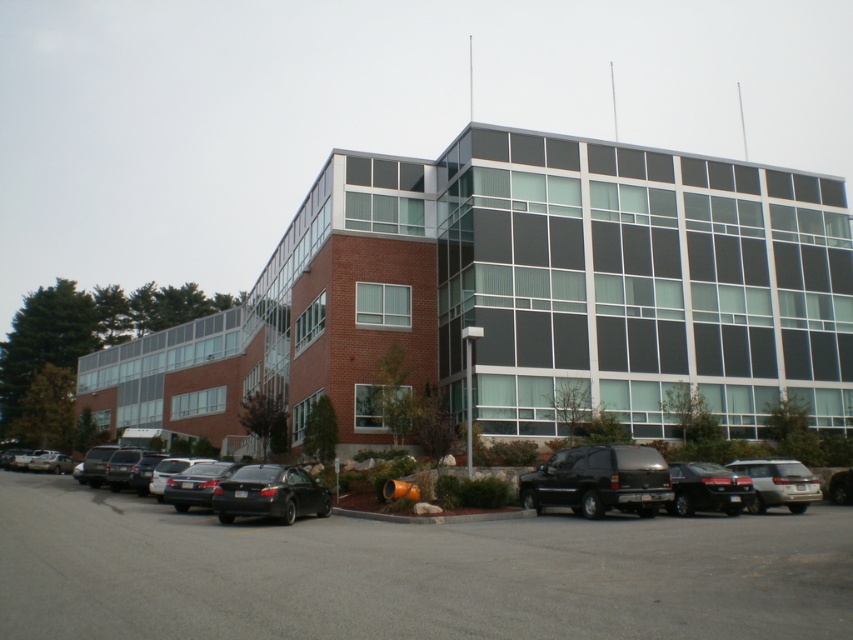
You are a delivery person needing to park your delivery van that is 14 feet long. You see the gray asphalt parking lot at lower center and the black matte suv at center. Can your van fit in the parking space between them?

The distance between the gray asphalt parking lot at lower center and the black matte suv at center is 15.55 feet. Since your van is 14 feet long, it can fit in the parking space between them as there is enough space.

You are standing at the entrance of the building and want to locate the satin black suv at center. According to the coordinates provided, in which direction should you look to find it?

The satin black suv at center is located at coordinates point (706, 488), so you should look towards the center of the parking lot to find it.

You are a delivery person trying to park your van in the gray asphalt parking lot at lower center. There is a black matte suv at center blocking the entrance. Can you drive around the suv to access the parking lot?

The gray asphalt parking lot at lower center is in front of the black matte suv at center, meaning the suv is between you and the parking lot entrance. To access the parking lot, you would need to maneuver around the suv either to the left or right side, provided there is enough space. However, since the parking lot is at lower center and the suv is at center, it might be positioned directly in front, requiring you to go around it carefully. Check for available space on either side to navigate past the suv.